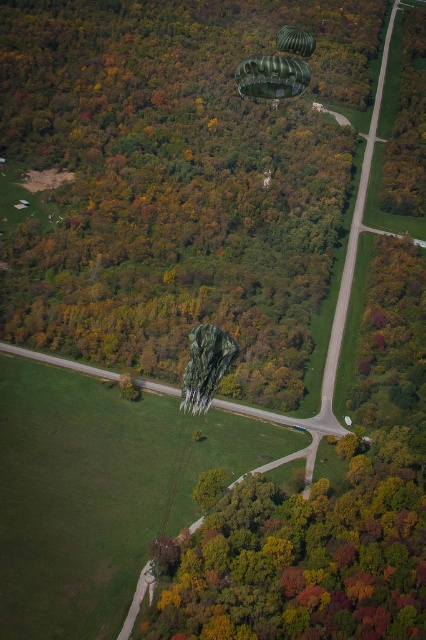
In the scene shown: You are a drone operator trying to capture the best aerial shot of the green matte parachute at center. The parachute is located at coordinates point [204,365]. What is the exact location of the green matte parachute at center?

The green matte parachute at center is located at point [204,365].